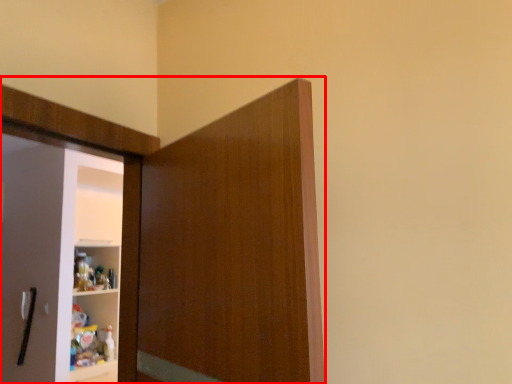
Question: From the image's perspective, where is cupboard (annotated by the red box) located in relation to door handle in the image?

Choices:
 (A) above
 (B) below

Answer: (A)